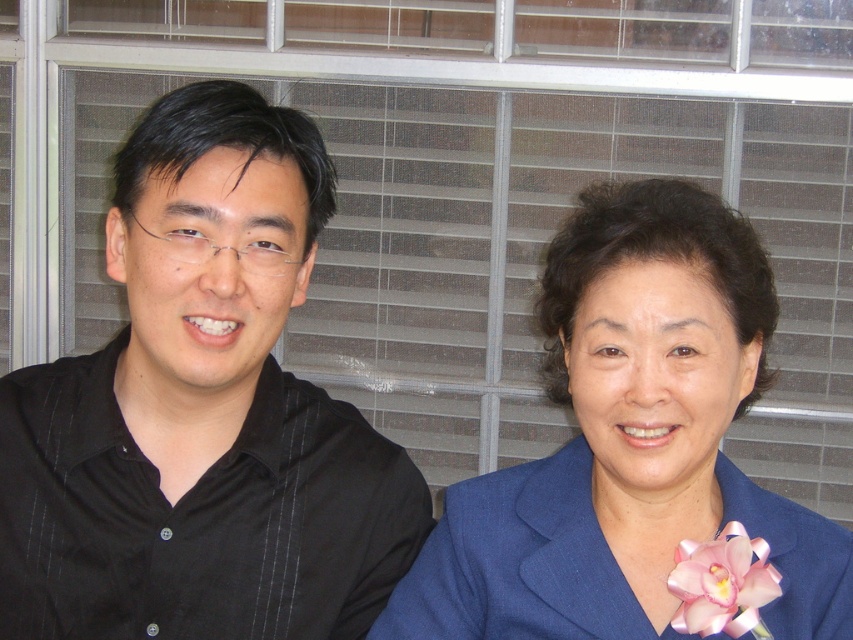
Question: Which object appears farthest from the camera in this image?

Choices:
 (A) pink satin flower at lower right
 (B) blue fabric jacket at right

Answer: (A)

Question: Observing the image, what is the correct spatial positioning of black pinstripe shirt at left in reference to blue fabric jacket at right?

Choices:
 (A) left
 (B) right

Answer: (A)

Question: Can you confirm if black pinstripe shirt at left is positioned below blue fabric jacket at right?

Choices:
 (A) no
 (B) yes

Answer: (A)

Question: Is black pinstripe shirt at left smaller than pink satin flower at lower right?

Choices:
 (A) no
 (B) yes

Answer: (A)

Question: Estimate the real-world distances between objects in this image. Which object is closer to the black pinstripe shirt at left?

Choices:
 (A) pink satin flower at lower right
 (B) blue fabric jacket at right

Answer: (B)

Question: Which point appears closest to the camera in this image?

Choices:
 (A) (550, 531)
 (B) (294, 497)
 (C) (724, 560)

Answer: (C)